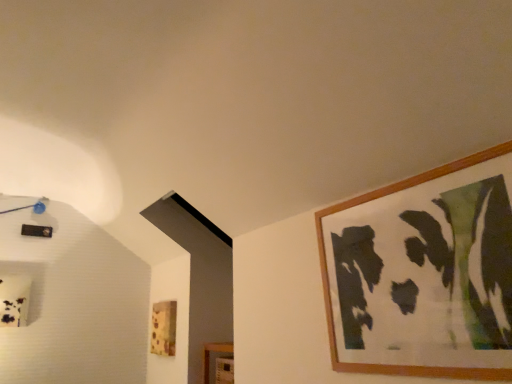
Based on the photo, measure the distance between point (164, 316) and camera.

The distance of point (164, 316) from camera is 2.69 meters.

What is the approximate height of wooden picture frame at lower center, the 2th picture frame when ordered from front to back?

12.66 inches.

At what (x,y) coordinates should I click in order to perform the action: click on wooden picture frame at lower center, the 2th picture frame when ordered from front to back. Please return your answer as a coordinate pair (x, y). Looking at the image, I should click on [163, 328].

What do you see at coordinates (163, 328) in the screenshot? I see `wooden picture frame at lower center, positioned as the first picture frame in left-to-right order` at bounding box center [163, 328].

What is the approximate height of wooden picture frame at upper right, the 2th picture frame in the left-to-right sequence?

wooden picture frame at upper right, the 2th picture frame in the left-to-right sequence, is 21.67 inches tall.

Where is `wooden picture frame at upper right, positioned as the 1th picture frame in front-to-back order`? The width and height of the screenshot is (512, 384). wooden picture frame at upper right, positioned as the 1th picture frame in front-to-back order is located at coordinates (424, 273).

The height and width of the screenshot is (384, 512). Describe the element at coordinates (424, 273) in the screenshot. I see `wooden picture frame at upper right, positioned as the 1th picture frame in front-to-back order` at that location.

Where is `wooden picture frame at lower center, which appears as the first picture frame when viewed from the back`? The image size is (512, 384). wooden picture frame at lower center, which appears as the first picture frame when viewed from the back is located at coordinates (163, 328).

Considering the positions of objects wooden picture frame at lower center, which is counted as the first picture frame, starting from the bottom, and wooden picture frame at upper right, the 2th picture frame in the left-to-right sequence, in the image provided, who is more to the left, wooden picture frame at lower center, which is counted as the first picture frame, starting from the bottom, or wooden picture frame at upper right, the 2th picture frame in the left-to-right sequence,?

wooden picture frame at lower center, which is counted as the first picture frame, starting from the bottom, is more to the left.

Is wooden picture frame at lower center, which appears as the second picture frame when viewed from the right, in front of or behind wooden picture frame at upper right, the 2th picture frame in the left-to-right sequence, in the image?

wooden picture frame at lower center, which appears as the second picture frame when viewed from the right, is behind wooden picture frame at upper right, the 2th picture frame in the left-to-right sequence.

Which is less distant, (163, 338) or (398, 260)?

The point (398, 260) is closer to the camera.

From the image's perspective, who appears lower, wooden picture frame at lower center, the 2th picture frame when ordered from front to back, or wooden picture frame at upper right, the second picture frame when ordered from bottom to top?

wooden picture frame at lower center, the 2th picture frame when ordered from front to back, from the image's perspective.

From a real-world perspective, between wooden picture frame at lower center, which appears as the second picture frame when viewed from the right, and wooden picture frame at upper right, positioned as the 1th picture frame in front-to-back order, who is vertically lower?

wooden picture frame at lower center, which appears as the second picture frame when viewed from the right.

Is wooden picture frame at lower center, which is counted as the first picture frame, starting from the bottom, wider or thinner than wooden picture frame at upper right, positioned as the 1th picture frame in front-to-back order?

Considering their sizes, wooden picture frame at lower center, which is counted as the first picture frame, starting from the bottom, looks slimmer than wooden picture frame at upper right, positioned as the 1th picture frame in front-to-back order.

Considering the sizes of objects wooden picture frame at lower center, which appears as the second picture frame when viewed from the right, and wooden picture frame at upper right, arranged as the 1th picture frame when viewed from the top, in the image provided, who is taller, wooden picture frame at lower center, which appears as the second picture frame when viewed from the right, or wooden picture frame at upper right, arranged as the 1th picture frame when viewed from the top,?

With more height is wooden picture frame at upper right, arranged as the 1th picture frame when viewed from the top.

Who is smaller, wooden picture frame at lower center, the 2th picture frame when ordered from front to back, or wooden picture frame at upper right, the 2th picture frame in the left-to-right sequence?

wooden picture frame at lower center, the 2th picture frame when ordered from front to back, is smaller.

Is wooden picture frame at lower center, which is counted as the first picture frame, starting from the bottom, not inside wooden picture frame at upper right, arranged as the 1th picture frame when viewed from the top?

Absolutely, wooden picture frame at lower center, which is counted as the first picture frame, starting from the bottom, is external to wooden picture frame at upper right, arranged as the 1th picture frame when viewed from the top.

Is wooden picture frame at lower center, which ranks as the second picture frame in top-to-bottom order, positioned far away from wooden picture frame at upper right, which ranks as the second picture frame in back-to-front order?

Yes, wooden picture frame at lower center, which ranks as the second picture frame in top-to-bottom order, and wooden picture frame at upper right, which ranks as the second picture frame in back-to-front order, are located far from each other.

Is wooden picture frame at lower center, positioned as the first picture frame in left-to-right order, facing away from wooden picture frame at upper right, the second picture frame when ordered from bottom to top?

That's not correct — wooden picture frame at lower center, positioned as the first picture frame in left-to-right order, is not looking away from wooden picture frame at upper right, the second picture frame when ordered from bottom to top.

How different are the orientations of wooden picture frame at lower center, which appears as the second picture frame when viewed from the right, and wooden picture frame at upper right, the 1th picture frame viewed from the right, in degrees?

The angle between the facing direction of wooden picture frame at lower center, which appears as the second picture frame when viewed from the right, and the facing direction of wooden picture frame at upper right, the 1th picture frame viewed from the right, is 1.35 degrees.

Measure the distance from wooden picture frame at lower center, positioned as the first picture frame in left-to-right order, to wooden picture frame at upper right, the 1th picture frame viewed from the right.

wooden picture frame at lower center, positioned as the first picture frame in left-to-right order, is 1.73 meters from wooden picture frame at upper right, the 1th picture frame viewed from the right.

You are a GUI agent. You are given a task and a screenshot of the screen. Output one action in this format:
    pyautogui.click(x=<x>, y=<y>)
    Task: Click on the picture frame behind the wooden picture frame at upper right, which ranks as the second picture frame in back-to-front order
    
    Given the screenshot: What is the action you would take?
    pyautogui.click(x=163, y=328)

Between wooden picture frame at upper right, arranged as the 1th picture frame when viewed from the top, and wooden picture frame at lower center, the 2th picture frame when ordered from front to back, which one appears on the left side from the viewer's perspective?

wooden picture frame at lower center, the 2th picture frame when ordered from front to back, is more to the left.

Which object is closer to the camera, wooden picture frame at upper right, the 1th picture frame viewed from the right, or wooden picture frame at lower center, positioned as the first picture frame in left-to-right order?

wooden picture frame at upper right, the 1th picture frame viewed from the right, is in front.

Is point (345, 363) positioned before point (170, 347)?

Yes, point (345, 363) is closer to viewer.

From the image's perspective, is wooden picture frame at upper right, which ranks as the second picture frame in back-to-front order, on top of wooden picture frame at lower center, which appears as the first picture frame when viewed from the back?

Indeed, from the image's perspective, wooden picture frame at upper right, which ranks as the second picture frame in back-to-front order, is shown above wooden picture frame at lower center, which appears as the first picture frame when viewed from the back.

From a real-world perspective, who is located higher, wooden picture frame at upper right, the 2th picture frame in the left-to-right sequence, or wooden picture frame at lower center, positioned as the first picture frame in left-to-right order?

In real-world perspective, wooden picture frame at upper right, the 2th picture frame in the left-to-right sequence, is above.

Which object is thinner, wooden picture frame at upper right, the second picture frame when ordered from bottom to top, or wooden picture frame at lower center, which appears as the second picture frame when viewed from the right?

Thinner between the two is wooden picture frame at lower center, which appears as the second picture frame when viewed from the right.

Who is shorter, wooden picture frame at upper right, positioned as the 1th picture frame in front-to-back order, or wooden picture frame at lower center, which ranks as the second picture frame in top-to-bottom order?

wooden picture frame at lower center, which ranks as the second picture frame in top-to-bottom order.

Between wooden picture frame at upper right, positioned as the 1th picture frame in front-to-back order, and wooden picture frame at lower center, positioned as the first picture frame in left-to-right order, which one has larger size?

With larger size is wooden picture frame at upper right, positioned as the 1th picture frame in front-to-back order.

Is wooden picture frame at upper right, positioned as the 1th picture frame in front-to-back order, not inside wooden picture frame at lower center, which appears as the second picture frame when viewed from the right?

Indeed, wooden picture frame at upper right, positioned as the 1th picture frame in front-to-back order, is completely outside wooden picture frame at lower center, which appears as the second picture frame when viewed from the right.

Is wooden picture frame at upper right, which ranks as the second picture frame in back-to-front order, next to wooden picture frame at lower center, which appears as the second picture frame when viewed from the right?

No, wooden picture frame at upper right, which ranks as the second picture frame in back-to-front order, is not next to wooden picture frame at lower center, which appears as the second picture frame when viewed from the right.

Does wooden picture frame at upper right, the 1th picture frame viewed from the right, turn towards wooden picture frame at lower center, positioned as the first picture frame in left-to-right order?

No, wooden picture frame at upper right, the 1th picture frame viewed from the right, is not turned towards wooden picture frame at lower center, positioned as the first picture frame in left-to-right order.

At what (x,y) coordinates should I click in order to perform the action: click on picture frame above the wooden picture frame at lower center, which appears as the first picture frame when viewed from the back (from the image's perspective). Please return your answer as a coordinate pair (x, y). This screenshot has height=384, width=512. Looking at the image, I should click on (424, 273).

Where is `picture frame behind the wooden picture frame at upper right, which ranks as the second picture frame in back-to-front order`? picture frame behind the wooden picture frame at upper right, which ranks as the second picture frame in back-to-front order is located at coordinates (163, 328).

Image resolution: width=512 pixels, height=384 pixels. What are the coordinates of `picture frame above the wooden picture frame at lower center, the 2th picture frame when ordered from front to back (from the image's perspective)` in the screenshot? It's located at (424, 273).